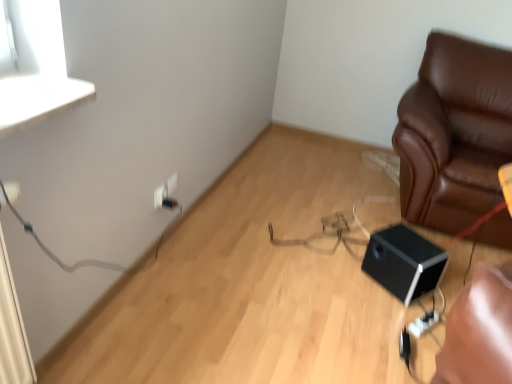
Question: Is black matte speaker at lower right facing away from white plastic electric outlet at upper center, marked as the third electric outlet in a back-to-front arrangement?

Choices:
 (A) no
 (B) yes

Answer: (A)

Question: From a real-world perspective, does black matte speaker at lower right sit lower than white plastic electric outlet at upper center, the 1th electric outlet viewed from the front?

Choices:
 (A) no
 (B) yes

Answer: (B)

Question: From the image's perspective, does black matte speaker at lower right appear higher than white plastic electric outlet at upper center, the 1th electric outlet viewed from the front?

Choices:
 (A) yes
 (B) no

Answer: (B)

Question: Does black matte speaker at lower right have a lesser height compared to white plastic electric outlet at upper center, the 1th electric outlet viewed from the front?

Choices:
 (A) yes
 (B) no

Answer: (B)

Question: Are black matte speaker at lower right and white plastic electric outlet at upper center, the 1th electric outlet viewed from the front, far apart?

Choices:
 (A) no
 (B) yes

Answer: (B)

Question: In terms of size, does brown leather couch at right appear bigger or smaller than white plastic electric outlet at upper center, marked as the third electric outlet in a back-to-front arrangement?

Choices:
 (A) small
 (B) big

Answer: (B)

Question: Visually, is brown leather couch at right positioned to the left or to the right of white plastic electric outlet at upper center, the 1th electric outlet viewed from the front?

Choices:
 (A) right
 (B) left

Answer: (A)

Question: Relative to white plastic electric outlet at upper center, the 1th electric outlet viewed from the front, is brown leather couch at right in front or behind?

Choices:
 (A) front
 (B) behind

Answer: (A)

Question: Is brown leather couch at right inside the boundaries of white plastic electric outlet at upper center, marked as the third electric outlet in a back-to-front arrangement, or outside?

Choices:
 (A) inside
 (B) outside

Answer: (B)

Question: Considering their positions, is black plastic electric outlet at lower left, the second electric outlet in the front-to-back sequence, located in front of or behind white plastic electric outlet at lower left, marked as the 3th electric outlet in a front-to-back arrangement?

Choices:
 (A) front
 (B) behind

Answer: (A)

Question: Visually, is black plastic electric outlet at lower left, the second electric outlet in the front-to-back sequence, positioned to the left or to the right of white plastic electric outlet at lower left, marked as the 3th electric outlet in a front-to-back arrangement?

Choices:
 (A) right
 (B) left

Answer: (B)

Question: In terms of height, does black plastic electric outlet at lower left, the 2th electric outlet when ordered from back to front, look taller or shorter compared to white plastic electric outlet at lower left, marked as the 3th electric outlet in a front-to-back arrangement?

Choices:
 (A) tall
 (B) short

Answer: (B)

Question: From the image's perspective, is black plastic electric outlet at lower left, the 2th electric outlet when ordered from back to front, located above or below white plastic electric outlet at lower left, marked as the 3th electric outlet in a front-to-back arrangement?

Choices:
 (A) below
 (B) above

Answer: (A)

Question: Considering the positions of black plastic electric outlet at lower left, the 2th electric outlet when ordered from back to front, and black matte speaker at lower right in the image, is black plastic electric outlet at lower left, the 2th electric outlet when ordered from back to front, wider or thinner than black matte speaker at lower right?

Choices:
 (A) thin
 (B) wide

Answer: (A)

Question: Is point (177, 205) closer or farther from the camera than point (398, 273)?

Choices:
 (A) farther
 (B) closer

Answer: (A)